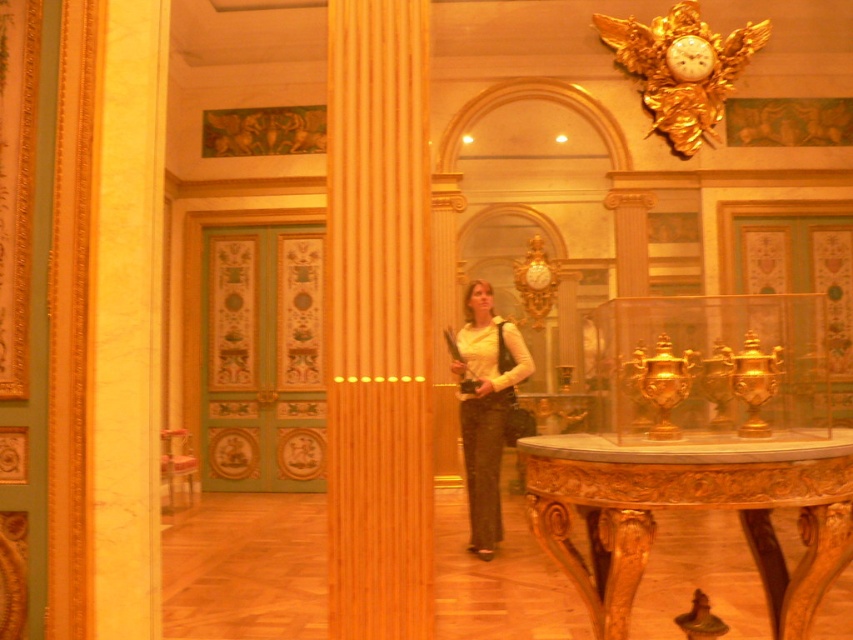
Consider the image. Is smooth wood pillar at center wider than white matte shirt at center?

Incorrect, smooth wood pillar at center's width does not surpass white matte shirt at center's.

Identify the location of smooth wood pillar at center. (378, 321).

Between point (412, 212) and point (486, 396), which one is positioned behind?

The point (486, 396) is more distant.

The image size is (853, 640). Find the location of `smooth wood pillar at center`. smooth wood pillar at center is located at coordinates (378, 321).

Does gold carved table at center have a smaller size compared to gold metallic clock at upper center?

No.

Measure the distance between gold carved table at center and camera.

gold carved table at center is 2.50 meters from camera.

Does point (550, 541) come closer to viewer compared to point (677, 49)?

That is True.

Where is `gold carved table at center`? This screenshot has height=640, width=853. gold carved table at center is located at coordinates (691, 508).

How distant is smooth wood pillar at center from gold metallic clock at upper center?

6.53 meters

Who is more forward, [343,262] or [697,38]?

Point [343,262] is in front.

This screenshot has height=640, width=853. Find the location of `smooth wood pillar at center`. smooth wood pillar at center is located at coordinates (378, 321).